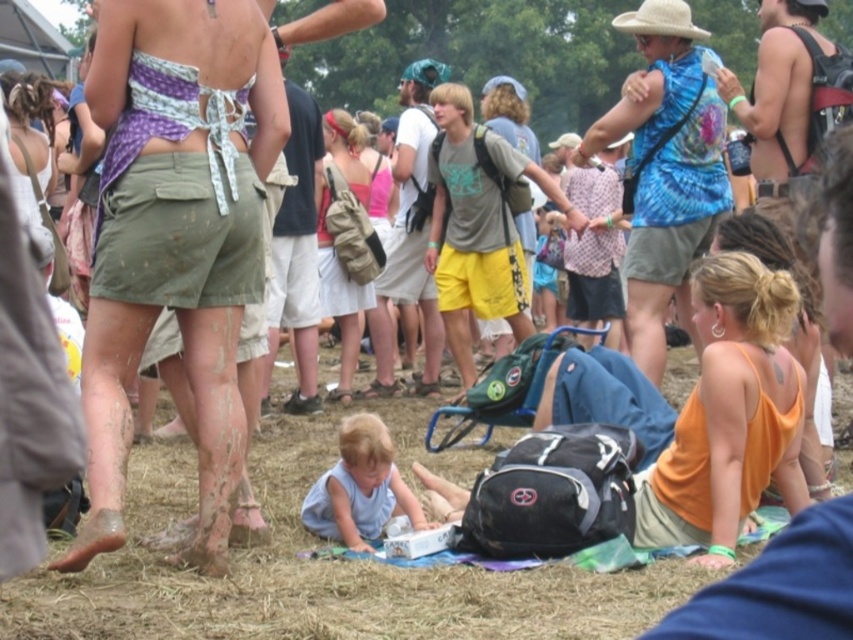
Question: Does orange matte tank top at lower right appear on the right side of matte pink tank top at center?

Choices:
 (A) yes
 (B) no

Answer: (A)

Question: Which object is farther from the camera taking this photo?

Choices:
 (A) matte purple bikini top at upper left
 (B) matte pink tank top at center
 (C) orange matte tank top at lower right

Answer: (B)

Question: Considering the real-world distances, which object is farthest from the matte purple bikini top at upper left?

Choices:
 (A) matte pink tank top at center
 (B) light blue fabric at lower center

Answer: (A)

Question: Can you confirm if matte purple bikini top at upper left is thinner than light blue fabric at lower center?

Choices:
 (A) yes
 (B) no

Answer: (B)

Question: Considering the real-world distances, which object is farthest from the matte pink tank top at center?

Choices:
 (A) orange matte tank top at lower right
 (B) matte purple bikini top at upper left

Answer: (A)

Question: Can you confirm if orange matte tank top at lower right is smaller than light blue fabric at lower center?

Choices:
 (A) yes
 (B) no

Answer: (B)